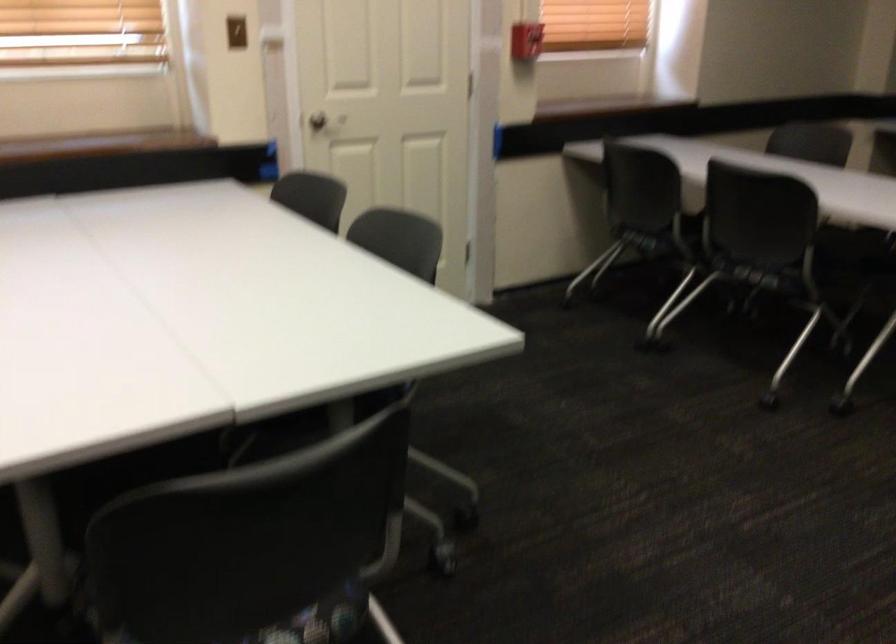
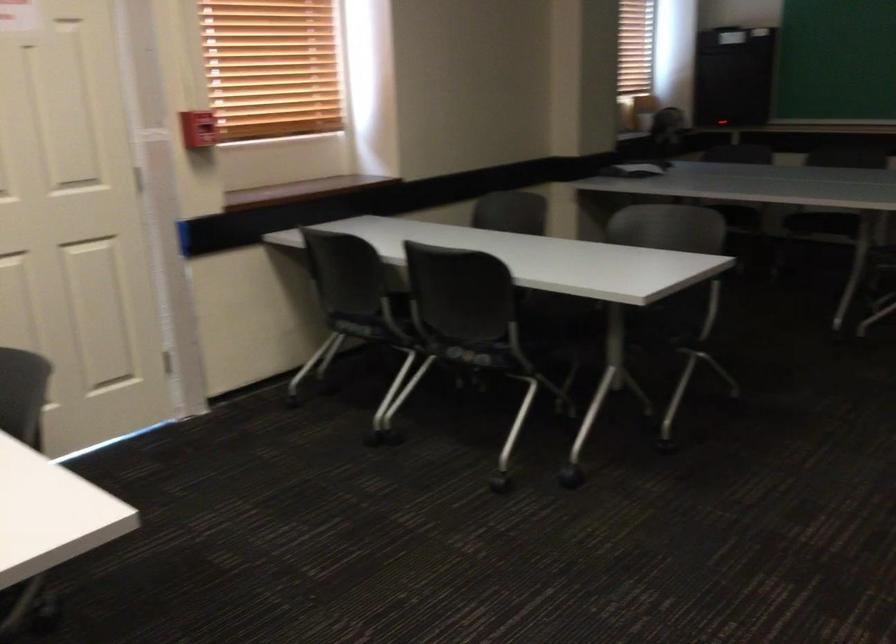
What movement of the cameraman would produce the second image?

The movement direction of the cameraman is right, forward.